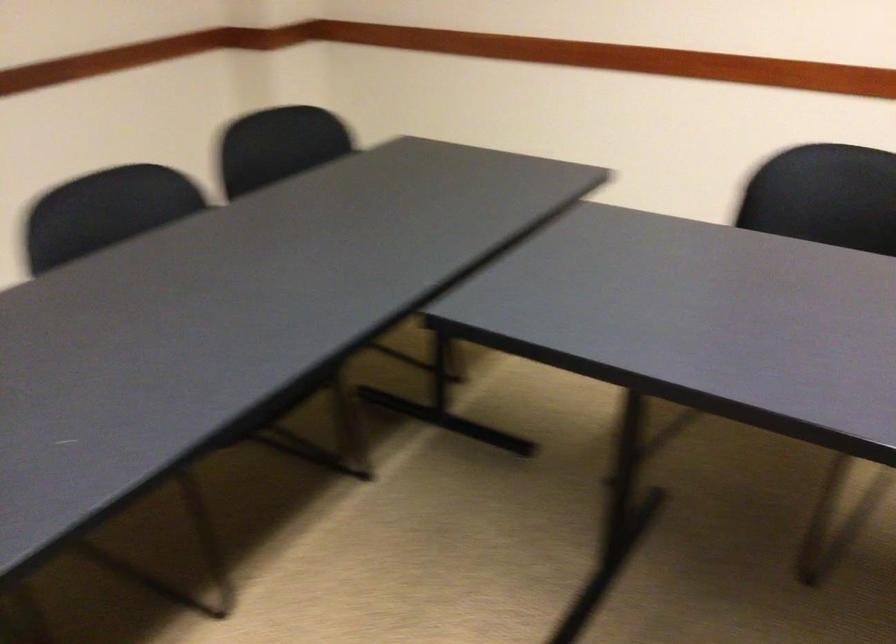
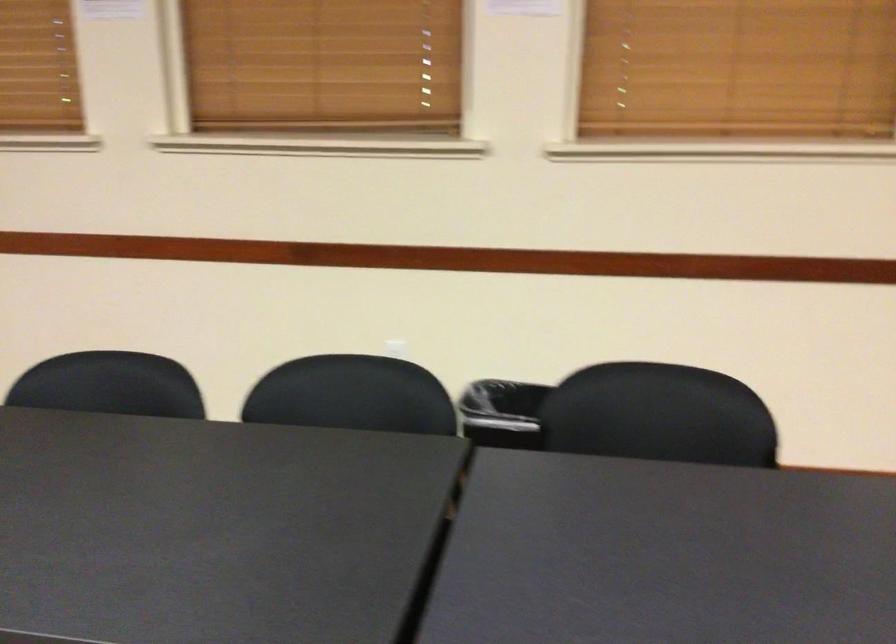
Question: The camera is either moving clockwise (left) or counter-clockwise (right) around the object. The first image is from the beginning of the video and the second image is from the end. Is the camera moving left or right when shooting the video?

Choices:
 (A) Left
 (B) Right

Answer: (B)